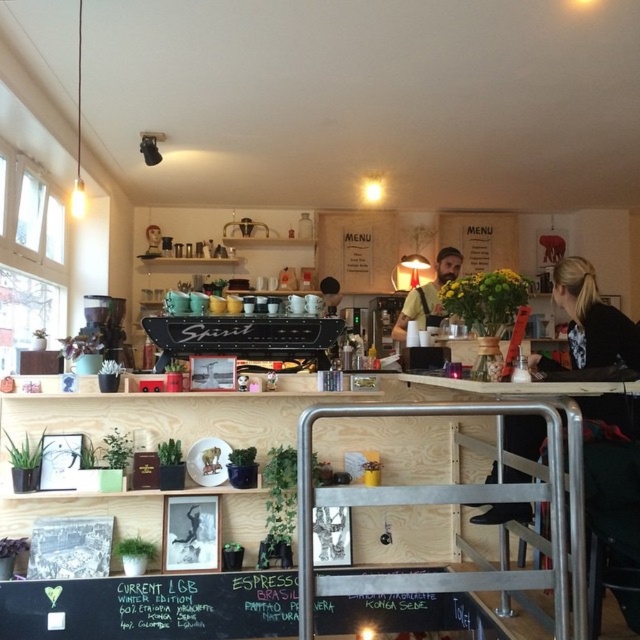
Question: Can you confirm if black fabric jacket at upper right is wider than metallic silver table at center?

Choices:
 (A) yes
 (B) no

Answer: (A)

Question: Is the position of black fabric jacket at upper right less distant than that of metallic silver table at center?

Choices:
 (A) yes
 (B) no

Answer: (B)

Question: Which point is closer to the camera?

Choices:
 (A) black fabric jacket at upper right
 (B) black chalkboard at lower center
 (C) bearded man with beard at center

Answer: (A)

Question: Which of these objects is positioned farthest from the bearded man with beard at center?

Choices:
 (A) black fabric jacket at upper right
 (B) metallic silver table at center
 (C) black chalkboard at lower center

Answer: (C)

Question: Can you confirm if black chalkboard at lower center is positioned below black fabric jacket at upper right?

Choices:
 (A) no
 (B) yes

Answer: (B)

Question: Among these points, which one is nearest to the camera?

Choices:
 (A) (444, 256)
 (B) (3, 589)
 (C) (572, 285)

Answer: (B)